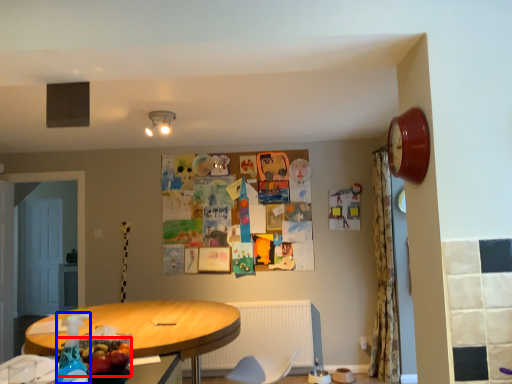
Question: Which object is further to the camera taking this photo, food (highlighted by a red box) or bottle (highlighted by a blue box)?

Choices:
 (A) food
 (B) bottle

Answer: (A)